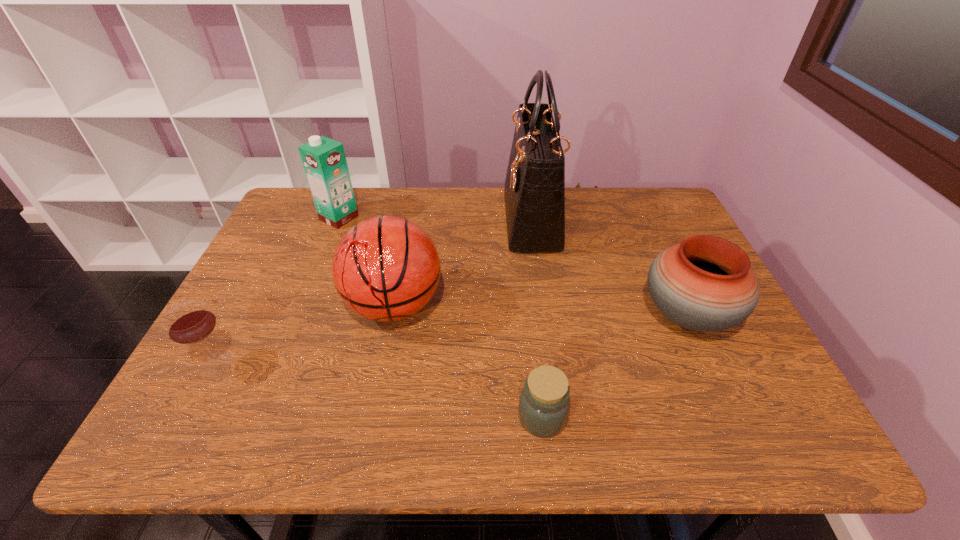
Find the location of a particular element. This screenshot has width=960, height=540. carton located in the left edge section of the desktop is located at coordinates (324, 160).

The image size is (960, 540). What are the coordinates of `wineglass present at the left edge` in the screenshot? It's located at (191, 322).

This screenshot has height=540, width=960. I want to click on object that is at the right edge, so click(x=705, y=283).

Where is `object that is at the far left corner`? This screenshot has width=960, height=540. object that is at the far left corner is located at coordinates (324, 160).

The image size is (960, 540). Identify the location of vacant space at the far edge. (579, 216).

Locate an element on the screen. The image size is (960, 540). free space at the near edge of the desktop is located at coordinates (452, 414).

Locate an element on the screen. vacant region at the left edge of the desktop is located at coordinates point(233,372).

What are the coordinates of `vacant space at the right edge of the desktop` in the screenshot? It's located at pyautogui.click(x=718, y=342).

I want to click on vacant area at the far left corner of the desktop, so click(279, 222).

This screenshot has width=960, height=540. In order to click on vacant space at the far right corner of the desktop in this screenshot , I will do `click(631, 206)`.